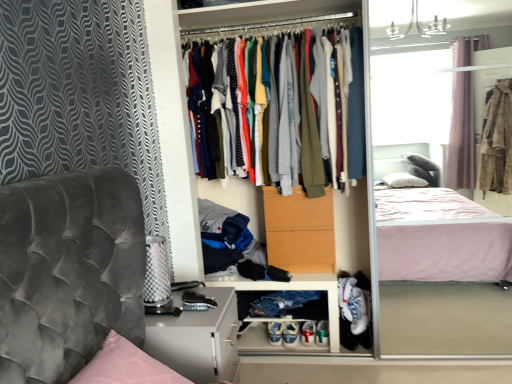
Locate an element on the screen. The image size is (512, 384). vacant area that is in front of white leather sneakers at lower center, the second footwear in the right-to-left sequence is located at coordinates click(x=276, y=355).